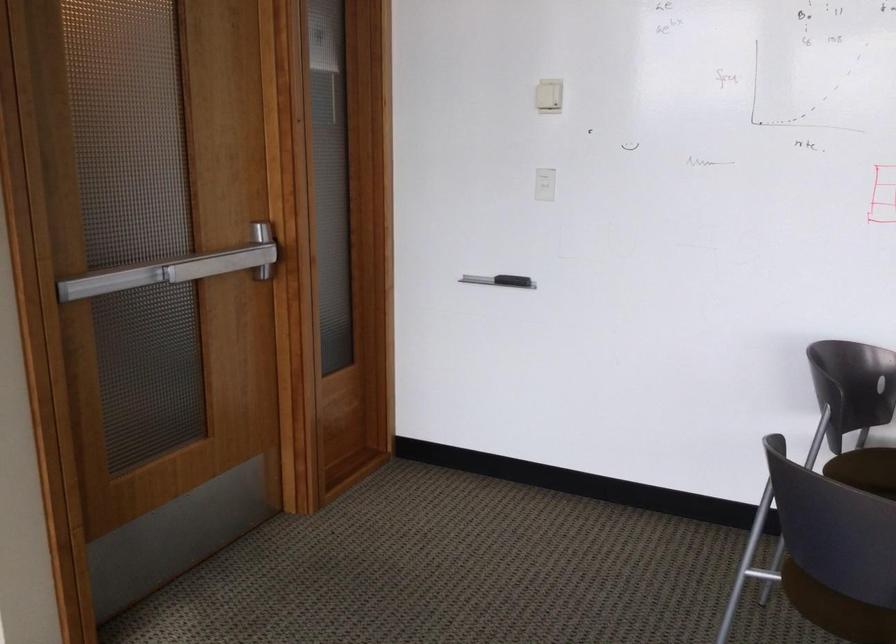
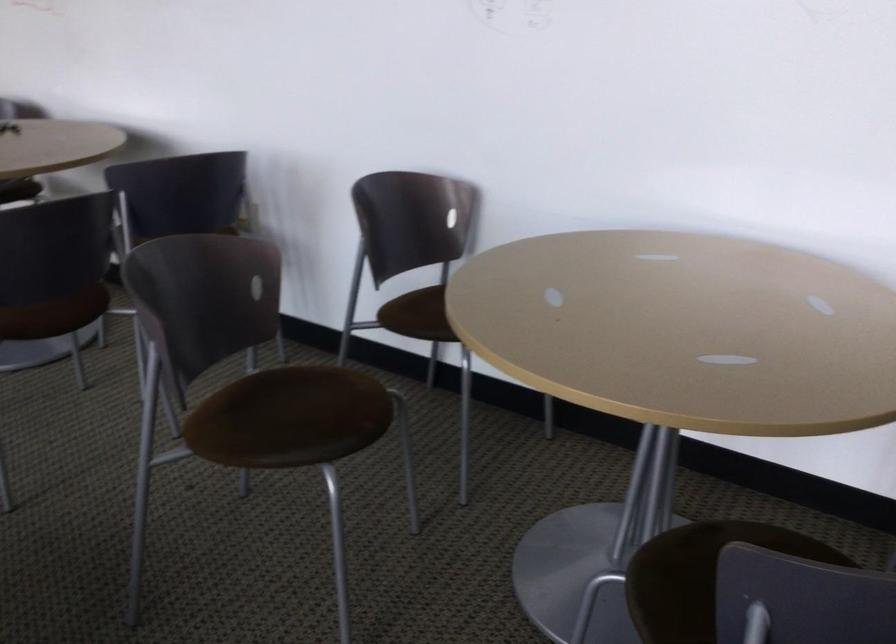
Question: Which direction would the cameraman need to move to produce the second image? Reply with the corresponding letter.

Choices:
 (A) Left
 (B) Right
 (C) Forward
 (D) Backward

Answer: (B)